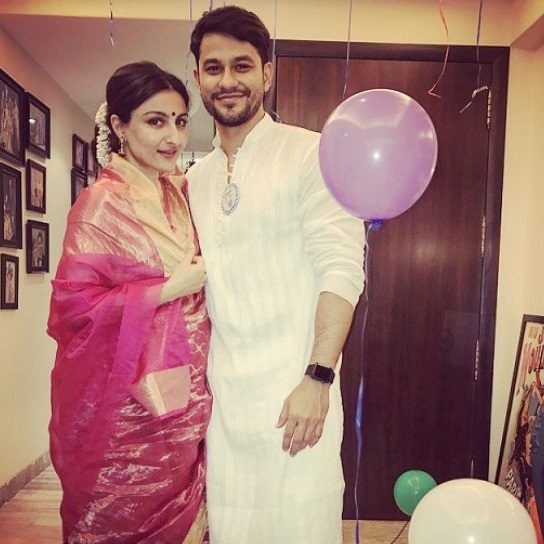
Find the location of a particular element. Image resolution: width=544 pixels, height=544 pixels. door is located at coordinates (403, 364).